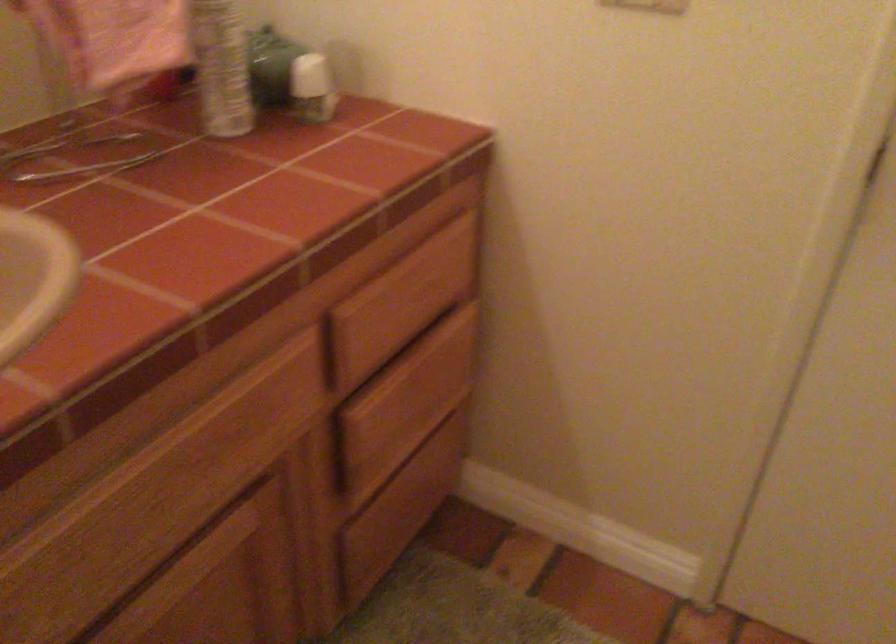
The first image is from the beginning of the video and the second image is from the end. How did the camera likely rotate when shooting the video?

The camera rotated toward right-down.